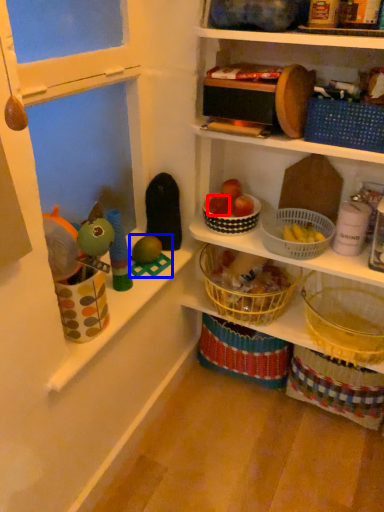
Question: Which object appears farthest to the camera in this image, apple (highlighted by a red box) or toy (highlighted by a blue box)?

Choices:
 (A) apple
 (B) toy

Answer: (A)